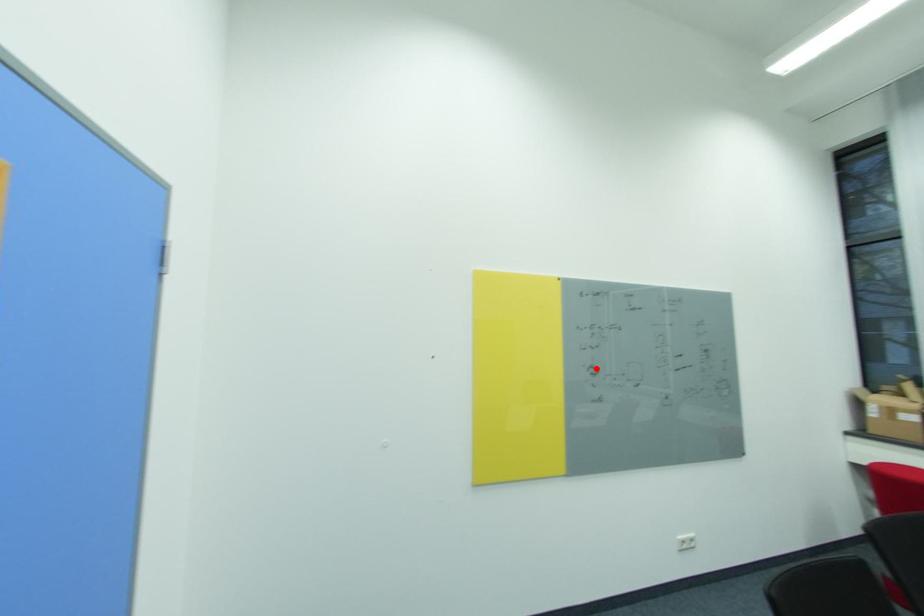
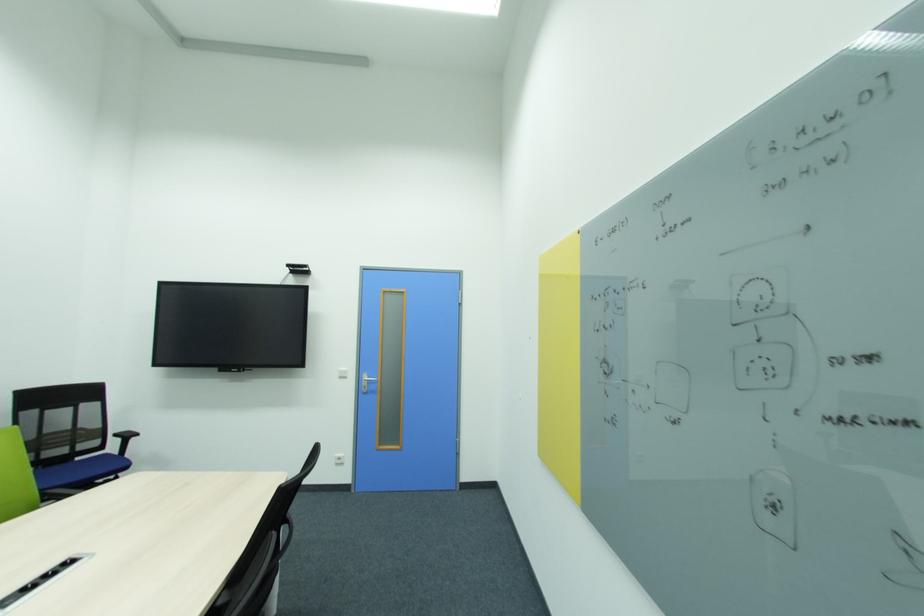
In the second image, find the point that corresponds to the highlighted location in the first image.

(610, 362)